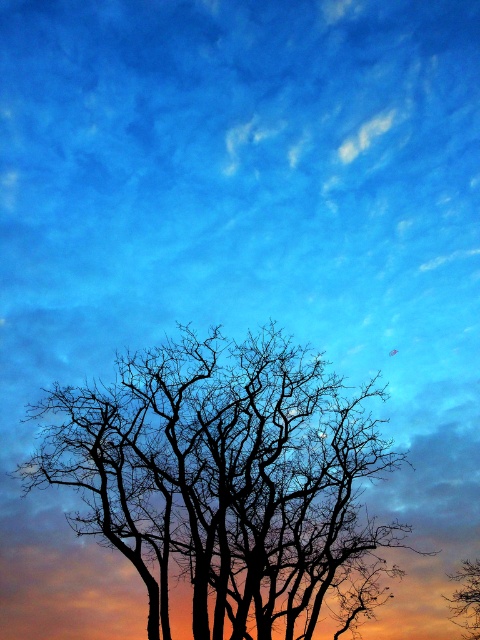
Who is positioned more to the left, silhouette bark tree at center or silhouette bare tree at center?

Positioned to the left is silhouette bark tree at center.

The image size is (480, 640). What do you see at coordinates (228, 481) in the screenshot?
I see `silhouette bark tree at center` at bounding box center [228, 481].

The height and width of the screenshot is (640, 480). What are the coordinates of `silhouette bark tree at center` in the screenshot? It's located at (228, 481).